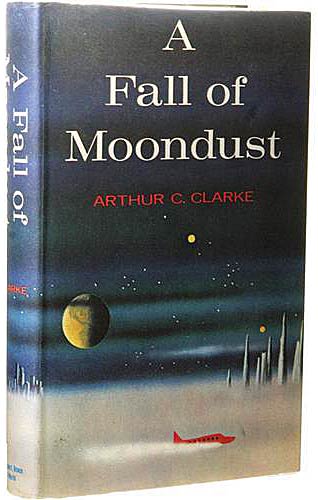
This screenshot has width=318, height=500. I want to click on book, so click(56, 255).